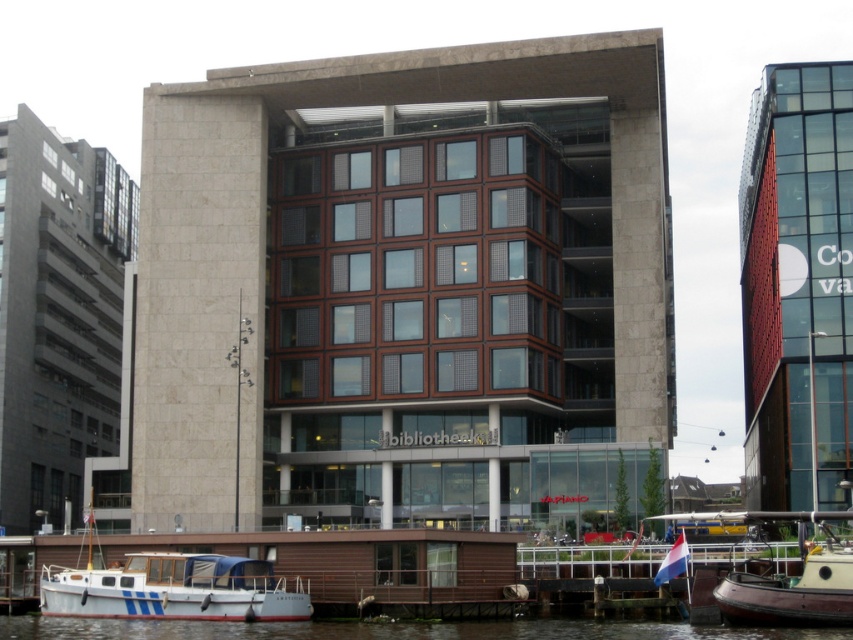
Question: Considering the relative positions of smooth water at lower center and brown wooden boat at lower right in the image provided, where is smooth water at lower center located with respect to brown wooden boat at lower right?

Choices:
 (A) right
 (B) left

Answer: (B)

Question: Does white matte boat at lower left appear on the left side of smooth water at lower center?

Choices:
 (A) no
 (B) yes

Answer: (B)

Question: Which point is farther to the camera?

Choices:
 (A) white matte boat at lower left
 (B) brown wooden boat at lower right
 (C) smooth water at lower center

Answer: (A)

Question: Considering the real-world distances, which object is farthest from the smooth water at lower center?

Choices:
 (A) brown wooden boat at lower right
 (B) white matte boat at lower left

Answer: (A)

Question: Is smooth water at lower center above brown wooden boat at lower right?

Choices:
 (A) yes
 (B) no

Answer: (B)

Question: Which object appears farthest from the camera in this image?

Choices:
 (A) white matte boat at lower left
 (B) brown wooden boat at lower right
 (C) smooth water at lower center

Answer: (A)